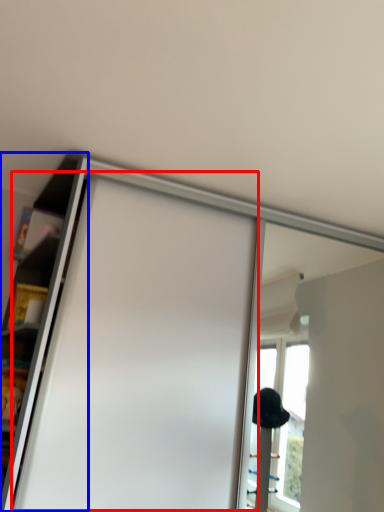
Question: Which of the following is the farthest to the observer, screen door (highlighted by a red box) or shelf (highlighted by a blue box)?

Choices:
 (A) screen door
 (B) shelf

Answer: (A)